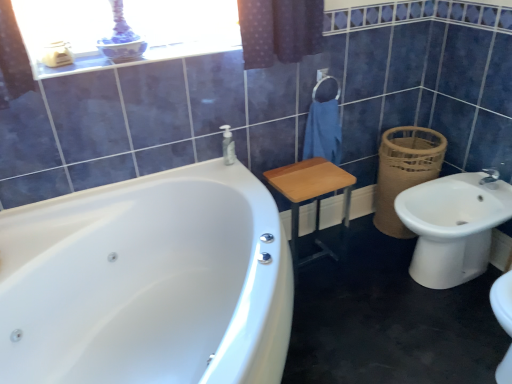
Where is `vacant space underneath wooden stool at center (from a real-world perspective)`? The height and width of the screenshot is (384, 512). vacant space underneath wooden stool at center (from a real-world perspective) is located at coordinates (316, 263).